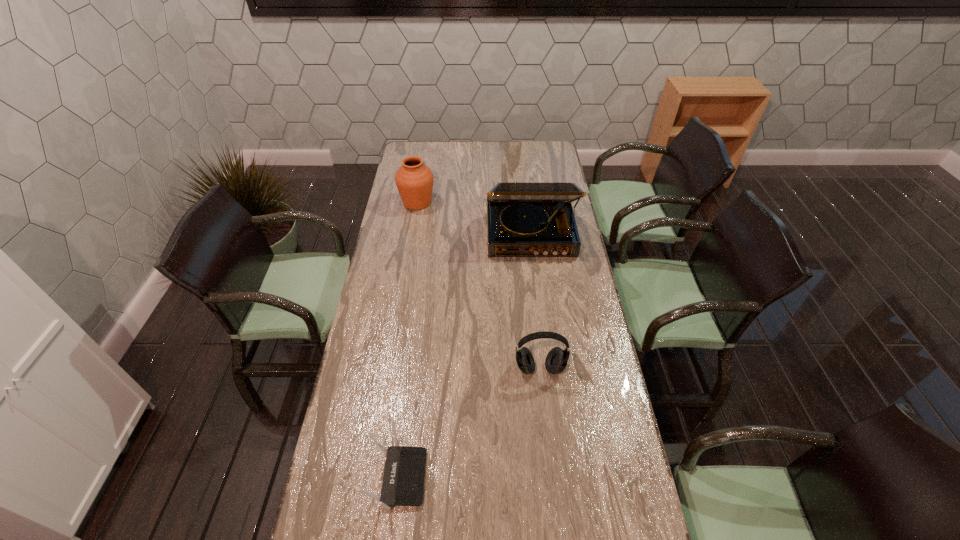
I want to click on free area in between the second tallest object and the third nearest object, so click(473, 219).

You are a GUI agent. You are given a task and a screenshot of the screen. Output one action in this format:
    pyautogui.click(x=<x>, y=<y>)
    Task: Click on the vacant area that lies between the third tallest object and the second farthest object
    The height and width of the screenshot is (540, 960).
    Given the screenshot: What is the action you would take?
    pyautogui.click(x=535, y=302)

The height and width of the screenshot is (540, 960). I want to click on vacant area that lies between the router and the third shortest object, so click(x=407, y=340).

Where is `empty location between the third tallest object and the shortest object`? The height and width of the screenshot is (540, 960). empty location between the third tallest object and the shortest object is located at coordinates (468, 423).

Locate an element on the screen. The width and height of the screenshot is (960, 540). empty space between the farthest object and the tallest object is located at coordinates (473, 219).

Locate an element on the screen. empty location between the urn and the tallest object is located at coordinates click(x=473, y=219).

Locate an element on the screen. This screenshot has width=960, height=540. empty space that is in between the third nearest object and the second nearest object is located at coordinates (535, 302).

At what (x,y) coordinates should I click in order to perform the action: click on vacant space that's between the second shortest object and the third nearest object. Please return your answer as a coordinate pair (x, y). Looking at the image, I should click on (535, 302).

Where is `free spot between the farthest object and the record player`? This screenshot has width=960, height=540. free spot between the farthest object and the record player is located at coordinates (473, 219).

Identify the location of unoccupied position between the tallest object and the router. The width and height of the screenshot is (960, 540). (464, 356).